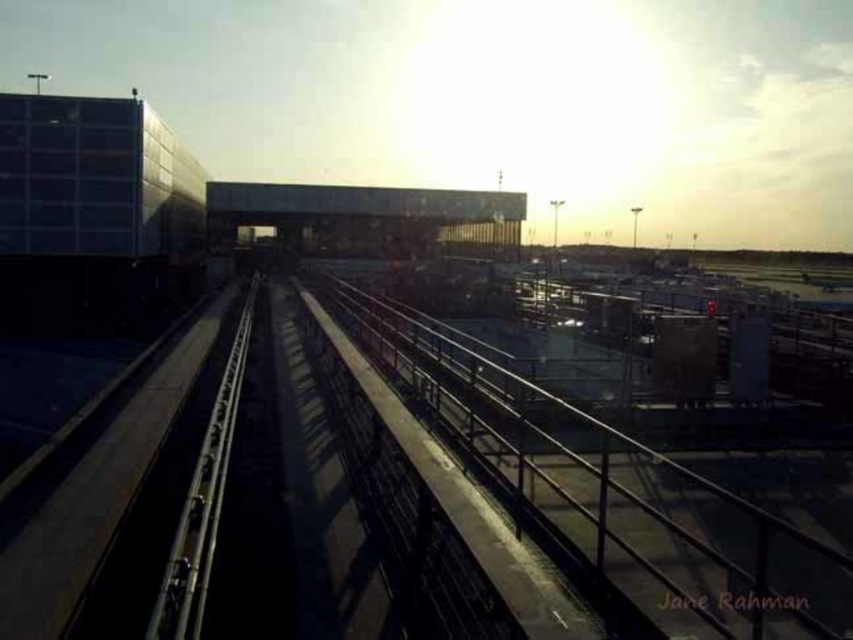
Is metallic gray train track at center smaller than dark gray concrete overpass at center?

Yes, metallic gray train track at center is smaller than dark gray concrete overpass at center.

Is metallic gray train track at center wider than dark gray concrete overpass at center?

Incorrect, metallic gray train track at center's width does not surpass dark gray concrete overpass at center's.

Measure the distance between point (537,476) and camera.

The distance of point (537,476) from camera is 646.84 feet.

Locate an element on the screen. The image size is (853, 640). metallic gray train track at center is located at coordinates (614, 493).

Is dark gray concrete overpass at center smaller than metallic smooth train track at center?

Actually, dark gray concrete overpass at center might be larger than metallic smooth train track at center.

Does point (465, 234) come closer to viewer compared to point (154, 616)?

No, (465, 234) is behind (154, 616).

Image resolution: width=853 pixels, height=640 pixels. I want to click on dark gray concrete overpass at center, so point(369,218).

Who is more forward, (561, 522) or (184, 518)?

Point (184, 518)

Is metallic gray train track at center below metallic smooth train track at center?

Actually, metallic gray train track at center is above metallic smooth train track at center.

Locate an element on the screen. metallic gray train track at center is located at coordinates (614, 493).